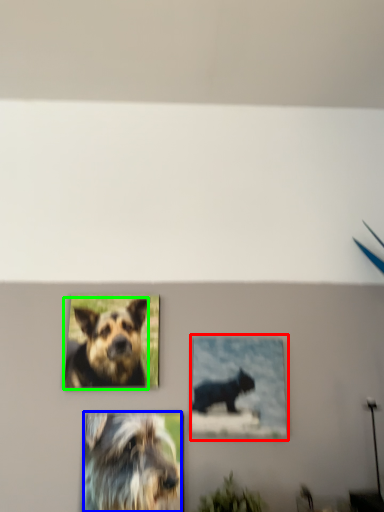
Question: Considering the real-world distances, which object is farthest from picture frame (highlighted by a red box)? dog (highlighted by a blue box) or dog (highlighted by a green box)?

Choices:
 (A) dog
 (B) dog

Answer: (B)